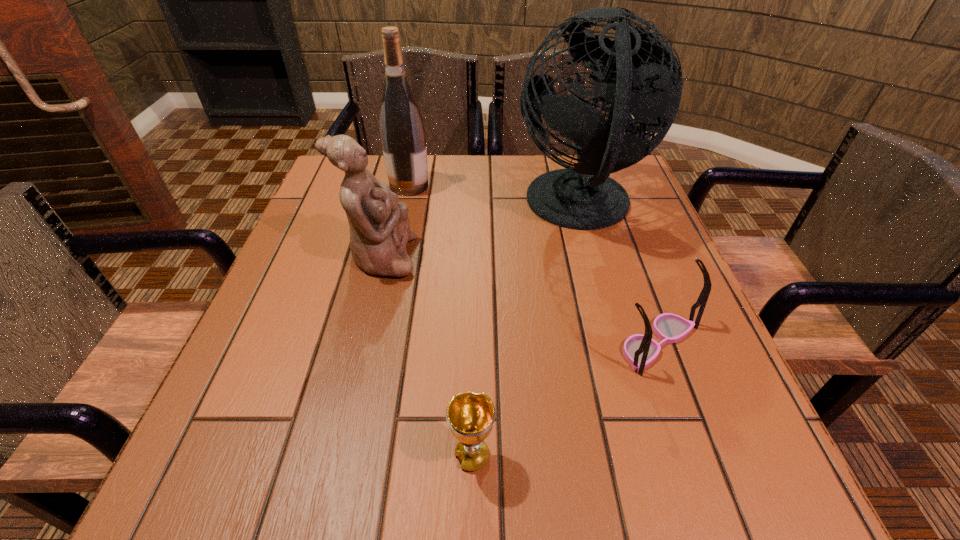
The image size is (960, 540). I want to click on vacant space at the far edge of the desktop, so click(x=486, y=183).

Locate an element on the screen. The height and width of the screenshot is (540, 960). free region at the near edge is located at coordinates (530, 467).

Find the location of `vacant space at the left edge`. vacant space at the left edge is located at coordinates (270, 360).

What are the coordinates of `vacant region at the right edge` in the screenshot? It's located at (642, 237).

In the image, there is a desktop. Identify the location of vacant region at the far right corner. Image resolution: width=960 pixels, height=540 pixels. [x=637, y=192].

This screenshot has width=960, height=540. In order to click on free space between the figurine and the globe in this screenshot , I will do `click(480, 232)`.

At what (x,y) coordinates should I click in order to perform the action: click on empty location between the figurine and the globe. Please return your answer as a coordinate pair (x, y). Image resolution: width=960 pixels, height=540 pixels. Looking at the image, I should click on (480, 232).

Locate an element on the screen. The width and height of the screenshot is (960, 540). free space between the wine bottle and the nearest object is located at coordinates (441, 321).

Locate an element on the screen. This screenshot has height=540, width=960. vacant region between the wine bottle and the second nearest object is located at coordinates (534, 264).

What are the coordinates of `free space between the spectacles and the third tallest object` in the screenshot? It's located at pyautogui.click(x=519, y=300).